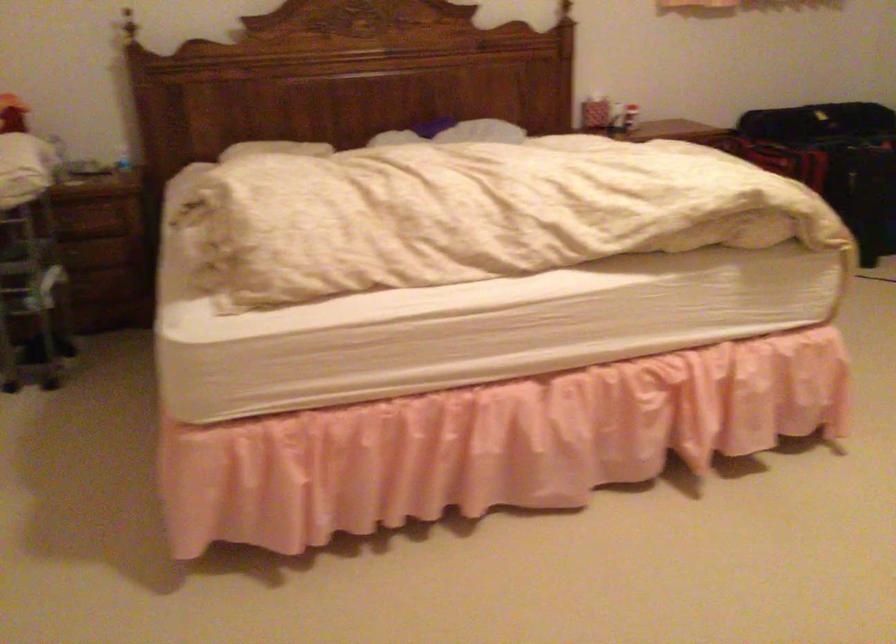
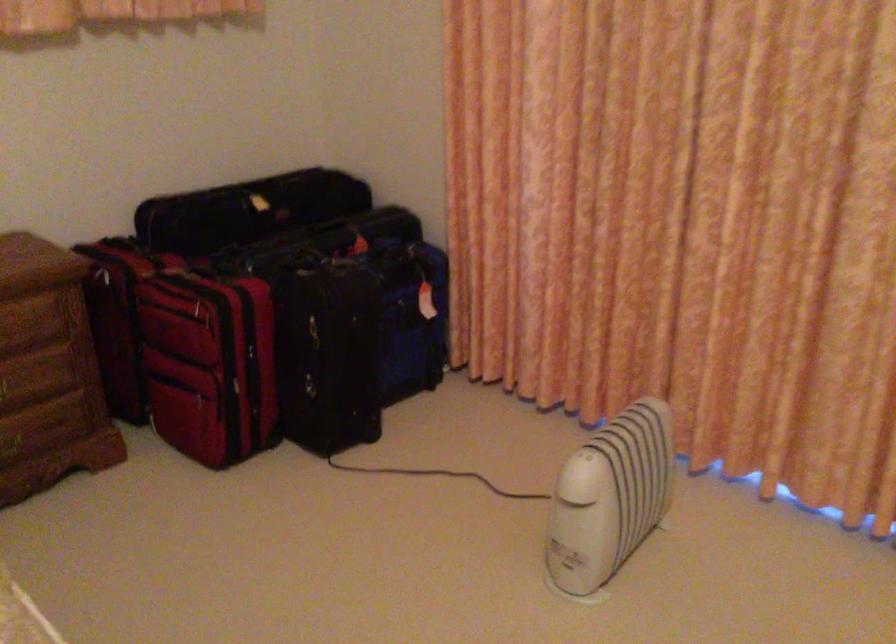
Locate, in the second image, the point that corresponds to (x=684, y=138) in the first image.

(14, 319)